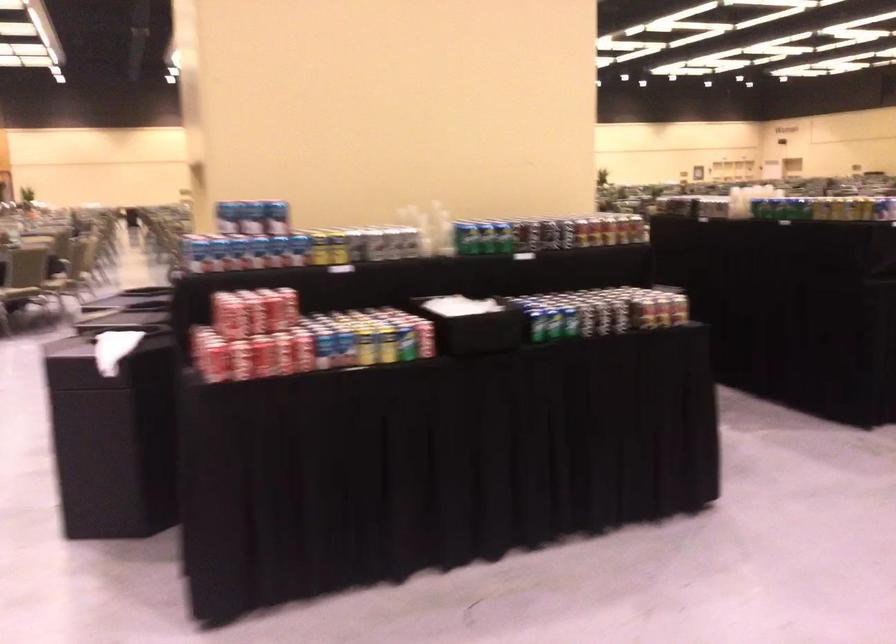
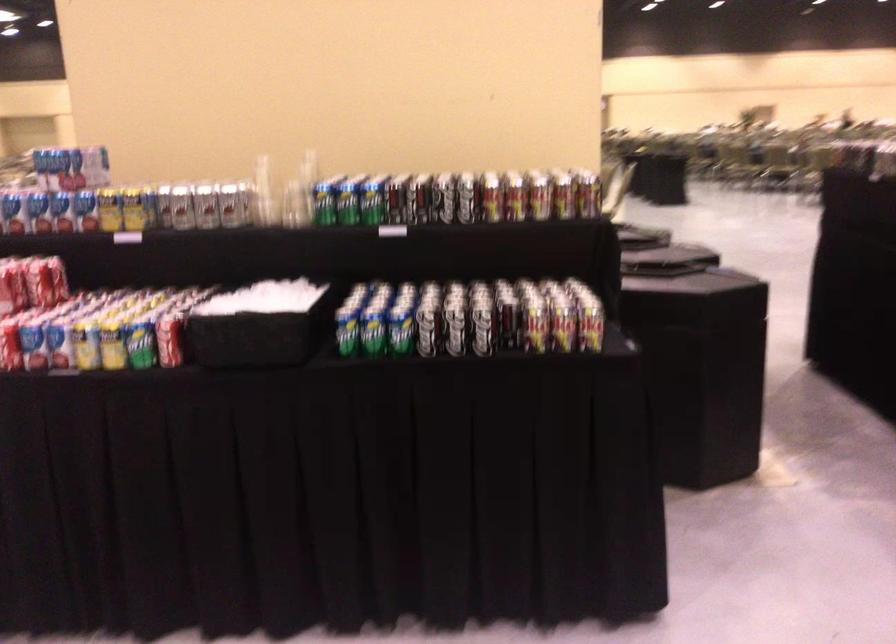
In the second image, find the point that corresponds to point 407,242 in the first image.

(228, 205)